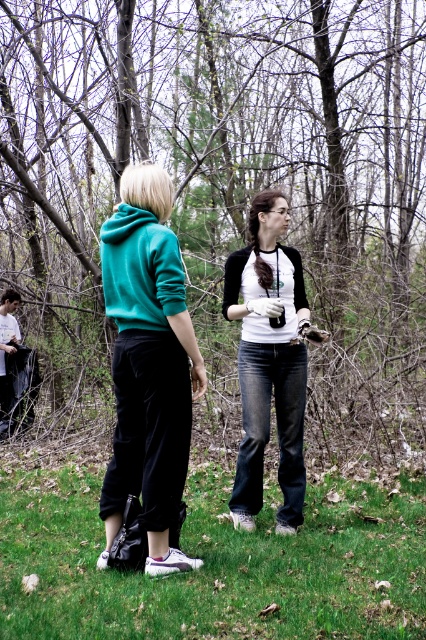
Question: Is green grass at lower center in front of white matte t-shirt at center?

Choices:
 (A) yes
 (B) no

Answer: (A)

Question: Which point is farther from the camera taking this photo?

Choices:
 (A) (282, 554)
 (B) (336, 266)

Answer: (B)

Question: Which object is closer to the camera taking this photo?

Choices:
 (A) white matte t-shirt at center
 (B) green grass at lower center
 (C) brown wood tree at center
 (D) teal fleece sweatshirt at left

Answer: (B)

Question: Is white matte t-shirt at center further to camera compared to teal fleece sweatshirt at left?

Choices:
 (A) yes
 (B) no

Answer: (A)

Question: In this image, where is teal fleece hoodie at center located relative to white matte t-shirt at center?

Choices:
 (A) above
 (B) below

Answer: (A)

Question: Among these points, which one is farthest from the camera?

Choices:
 (A) (232, 317)
 (B) (331, 314)

Answer: (B)